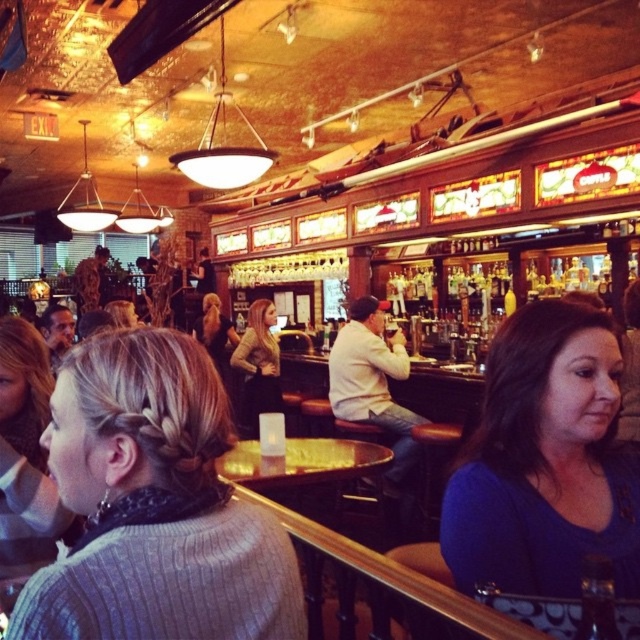
You are a photographer taking a picture of the knitted sweater at center and the blonde hair at center. Which object should you focus on first if you want to capture both in sharp focus?

The knitted sweater at center is below blonde hair at center, so you should focus on the knitted sweater at center first to ensure both are in sharp focus.

You are standing in the bar area and want to walk towards both the point at coordinates point (538, 403) and point (204, 342). Which point will you reach first?

You will reach point (538, 403) first because it is closer to you than point (204, 342).

You are a photographer standing at the entrance of the bar. You want to capture a photo of the blue matte shirt at center and the blonde hair at center. Which of the two objects should you focus on if you want to highlight the one that takes up more space in the frame?

The blonde hair at center takes up more space in the frame since it has a greater width compared to the blue matte shirt at center.